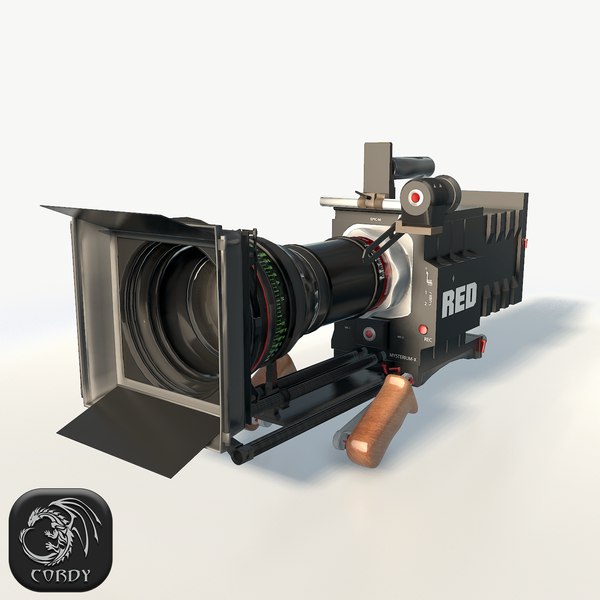
The height and width of the screenshot is (600, 600). What are the coordinates of `brown wooden handle` in the screenshot? It's located at (x=376, y=426).